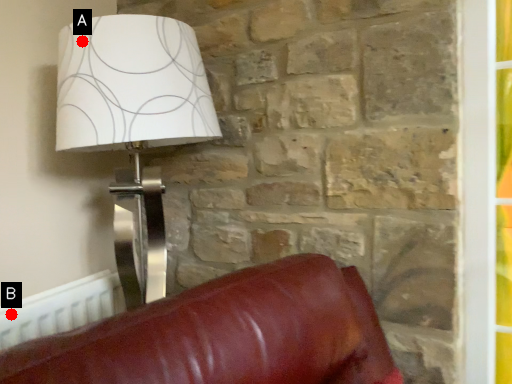
Question: Two points are circled on the image, labeled by A and B beside each circle. Among these points, which one is nearest to the camera?

Choices:
 (A) A is closer
 (B) B is closer

Answer: (A)